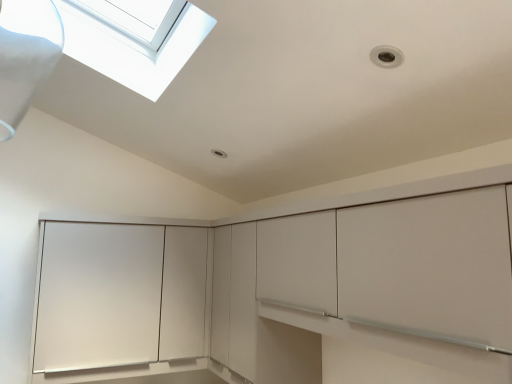
Question: Is point (108, 306) positioned closer to the camera than point (215, 329)?

Choices:
 (A) farther
 (B) closer

Answer: (B)

Question: Is matte white cabinet at lower left inside or outside of matte white cabinet at center?

Choices:
 (A) outside
 (B) inside

Answer: (A)

Question: From a real-world perspective, relative to matte white cabinet at center, is matte white cabinet at lower left vertically above or below?

Choices:
 (A) below
 (B) above

Answer: (A)

Question: Is matte white cabinet at center taller or shorter than matte white cabinet at lower left?

Choices:
 (A) tall
 (B) short

Answer: (A)

Question: In terms of width, does matte white cabinet at center look wider or thinner when compared to matte white cabinet at lower left?

Choices:
 (A) wide
 (B) thin

Answer: (B)

Question: Is point (440, 240) positioned closer to the camera than point (117, 284)?

Choices:
 (A) farther
 (B) closer

Answer: (B)

Question: From the image's perspective, is matte white cabinet at center above or below matte white cabinet at lower left?

Choices:
 (A) below
 (B) above

Answer: (B)